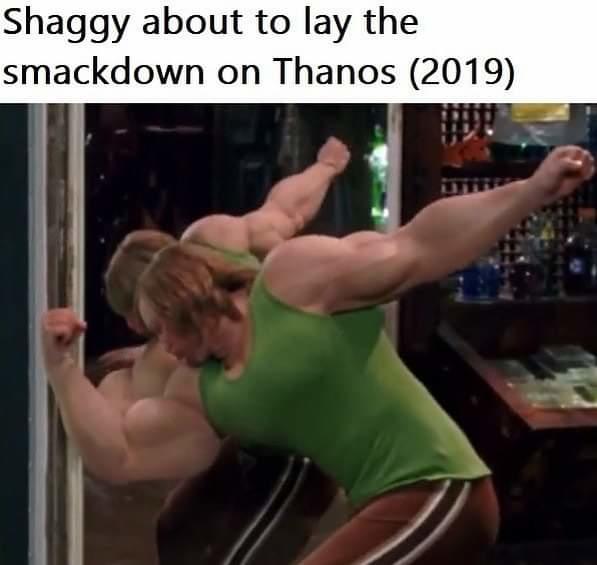
The image size is (597, 565). What are the coordinates of `mirror` in the screenshot? It's located at (212, 133).